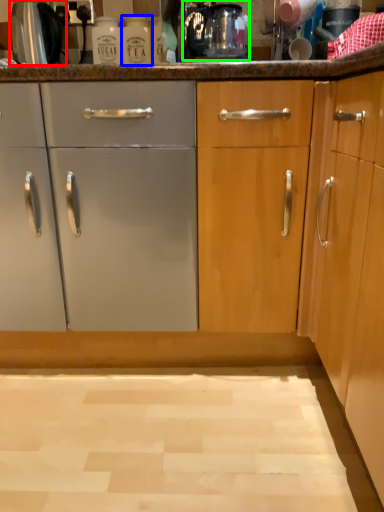
Question: Which is nearer to the appliance (highlighted by a red box)? bottle (highlighted by a blue box) or coffee machine (highlighted by a green box).

Choices:
 (A) bottle
 (B) coffee machine

Answer: (A)